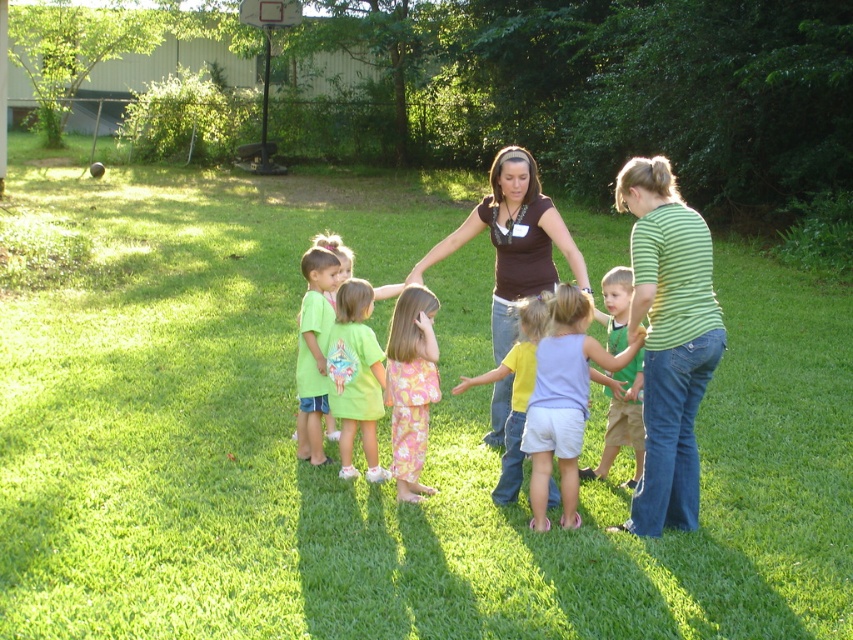
Which is below, green striped shirt at right or matte green t-shirt at center?

matte green t-shirt at center is below.

In the scene shown: Can you confirm if green striped shirt at right is positioned to the right of matte green t-shirt at center?

Yes, green striped shirt at right is to the right of matte green t-shirt at center.

This screenshot has width=853, height=640. Find the location of `green striped shirt at right`. green striped shirt at right is located at coordinates (668, 339).

Can you confirm if green striped shirt at right is positioned to the left of yellow cotton shirt at center?

No, green striped shirt at right is not to the left of yellow cotton shirt at center.

Is point (688, 346) positioned behind point (514, 388)?

No, it is not.

I want to click on green striped shirt at right, so click(x=668, y=339).

Who is more forward, (578, 269) or (549, 404)?

Point (549, 404) is in front.

Based on the photo, does brown fabric shirt at center have a greater height compared to light purple cotton shorts at center?

Indeed, brown fabric shirt at center has a greater height compared to light purple cotton shorts at center.

Between point (521, 237) and point (560, 524), which one is positioned behind?

Positioned behind is point (521, 237).

The image size is (853, 640). I want to click on brown fabric shirt at center, so tap(512, 241).